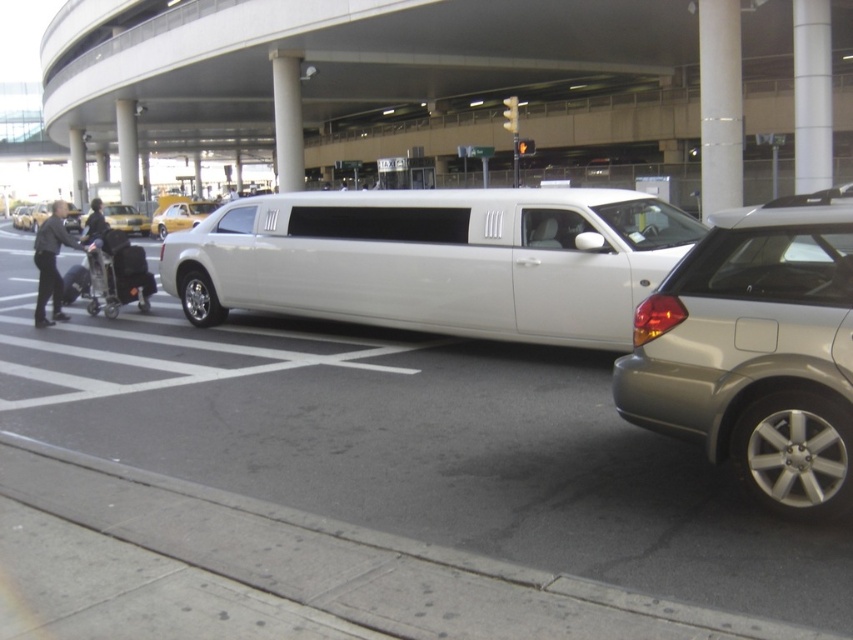
Question: Which point is farther to the camera?

Choices:
 (A) satin silver minivan at right
 (B) yellow rubber taxi cab at left

Answer: (B)

Question: Which point is closer to the camera?

Choices:
 (A) (157, 230)
 (B) (126, 212)
 (C) (32, 214)

Answer: (A)

Question: Can you confirm if yellow rubber taxi at upper left is positioned to the left of yellow rubber taxi cab at left?

Choices:
 (A) no
 (B) yes

Answer: (A)

Question: Does satin silver minivan at right have a greater width compared to yellow taxi at left?

Choices:
 (A) yes
 (B) no

Answer: (B)

Question: Which of the following is the closest to the observer?

Choices:
 (A) (131, 209)
 (B) (73, 216)
 (C) (712, 252)

Answer: (C)

Question: Considering the relative positions of yellow taxi at left and yellow rubber taxi cab at left in the image provided, where is yellow taxi at left located with respect to yellow rubber taxi cab at left?

Choices:
 (A) right
 (B) left

Answer: (A)